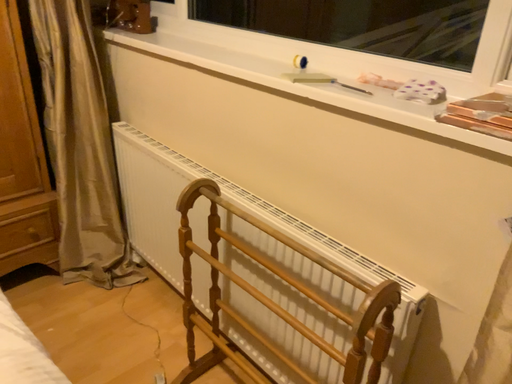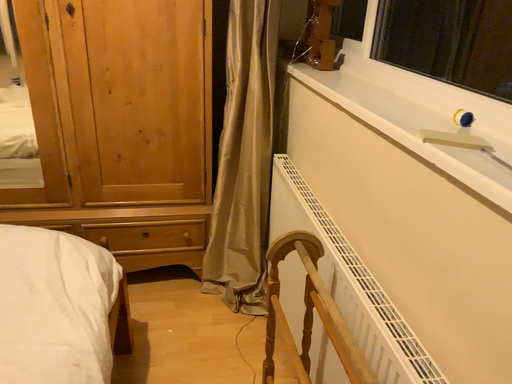
Question: Which way did the camera rotate in the video?

Choices:
 (A) rotated downward
 (B) rotated upward

Answer: (B)